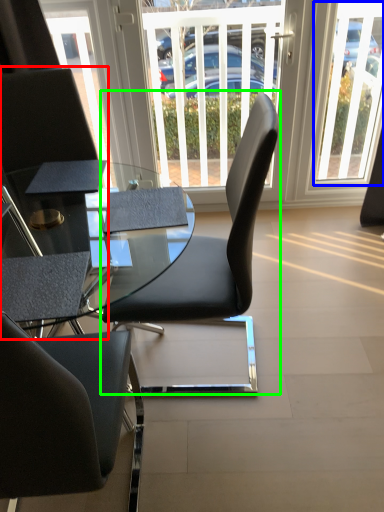
Question: Considering the real-world distances, which object is farthest from chair (highlighted by a red box)? window (highlighted by a blue box) or chair (highlighted by a green box)?

Choices:
 (A) window
 (B) chair

Answer: (A)